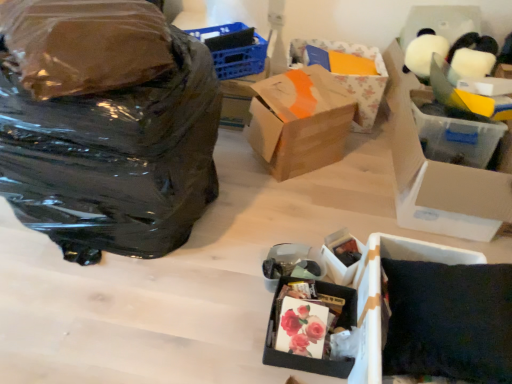
This screenshot has height=384, width=512. In order to click on free space in front of black plastic bag at left in this screenshot , I will do `click(99, 313)`.